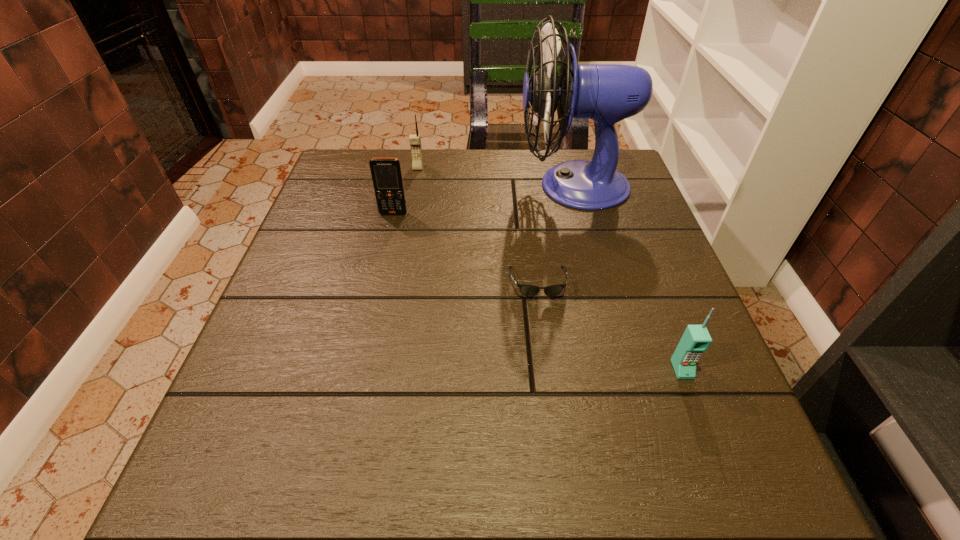
Locate an element on the screen. The image size is (960, 540). vacant space that satisfies the following two spatial constraints: 1. in front of the fan where the airflow is directed; 2. on the screen of the second nearest cellular telephone is located at coordinates (581, 214).